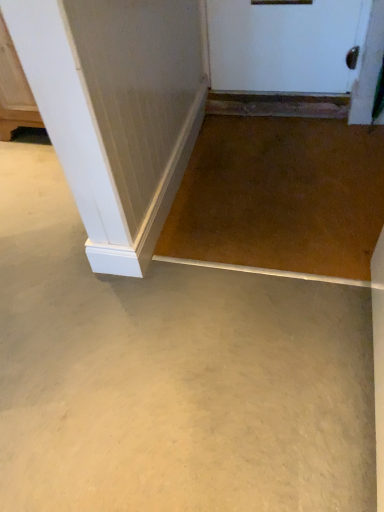
What do you see at coordinates (171, 375) in the screenshot? I see `smooth concrete floor at center` at bounding box center [171, 375].

Find the location of `smooth concrete floor at center`. smooth concrete floor at center is located at coordinates (171, 375).

The width and height of the screenshot is (384, 512). Describe the element at coordinates (368, 68) in the screenshot. I see `clear glass screen door at upper right` at that location.

What is the approximate height of clear glass screen door at upper right?

60.81 centimeters.

At what (x,y) coordinates should I click in order to perform the action: click on clear glass screen door at upper right. Please return your answer as a coordinate pair (x, y). The image size is (384, 512). Looking at the image, I should click on (368, 68).

This screenshot has height=512, width=384. Identify the location of smooth concrete floor at center. (171, 375).

Which is more to the right, clear glass screen door at upper right or smooth concrete floor at center?

clear glass screen door at upper right is more to the right.

Is clear glass screen door at upper right in front of or behind smooth concrete floor at center in the image?

clear glass screen door at upper right is positioned farther from the viewer than smooth concrete floor at center.

Does point (361, 69) come farther from viewer compared to point (198, 364)?

Yes, point (361, 69) is behind point (198, 364).

From the image's perspective, is clear glass screen door at upper right positioned above or below smooth concrete floor at center?

Clearly, from the image's perspective, clear glass screen door at upper right is above smooth concrete floor at center.

From a real-world perspective, is clear glass screen door at upper right beneath smooth concrete floor at center?

No, from a real-world perspective, clear glass screen door at upper right is not beneath smooth concrete floor at center.

Is clear glass screen door at upper right thinner than smooth concrete floor at center?

Correct, the width of clear glass screen door at upper right is less than that of smooth concrete floor at center.

Between clear glass screen door at upper right and smooth concrete floor at center, which one has less height?

Standing shorter between the two is smooth concrete floor at center.

Who is bigger, clear glass screen door at upper right or smooth concrete floor at center?

smooth concrete floor at center is bigger.

Is smooth concrete floor at center inside clear glass screen door at upper right?

No, clear glass screen door at upper right does not contain smooth concrete floor at center.

Is clear glass screen door at upper right far from smooth concrete floor at center?

Yes.

Could you tell me if clear glass screen door at upper right is turned towards smooth concrete floor at center?

No, clear glass screen door at upper right is not aimed at smooth concrete floor at center.

How distant is clear glass screen door at upper right from smooth concrete floor at center?

They are 5.10 feet apart.

Locate an element on the screen. The width and height of the screenshot is (384, 512). screen door on the right of smooth concrete floor at center is located at coordinates (368, 68).

Is smooth concrete floor at center at the right side of clear glass screen door at upper right?

No, smooth concrete floor at center is not to the right of clear glass screen door at upper right.

Is smooth concrete floor at center in front of or behind clear glass screen door at upper right in the image?

Visually, smooth concrete floor at center is located in front of clear glass screen door at upper right.

Does point (288, 418) come farther from viewer compared to point (382, 2)?

That is False.

From the image's perspective, is smooth concrete floor at center above or below clear glass screen door at upper right?

smooth concrete floor at center is below clear glass screen door at upper right.

From a real-world perspective, is smooth concrete floor at center positioned over clear glass screen door at upper right based on gravity?

No.

Which object is thinner, smooth concrete floor at center or clear glass screen door at upper right?

Thinner between the two is clear glass screen door at upper right.

Does smooth concrete floor at center have a greater height compared to clear glass screen door at upper right?

In fact, smooth concrete floor at center may be shorter than clear glass screen door at upper right.

Considering the relative sizes of smooth concrete floor at center and clear glass screen door at upper right in the image provided, is smooth concrete floor at center bigger than clear glass screen door at upper right?

Correct, smooth concrete floor at center is larger in size than clear glass screen door at upper right.

Is smooth concrete floor at center located outside clear glass screen door at upper right?

Absolutely, smooth concrete floor at center is external to clear glass screen door at upper right.

Is smooth concrete floor at center in contact with clear glass screen door at upper right?

They are not placed beside each other.

Is smooth concrete floor at center facing away from clear glass screen door at upper right?

No, smooth concrete floor at center is not facing away from clear glass screen door at upper right.

How different are the orientations of smooth concrete floor at center and clear glass screen door at upper right in degrees?

smooth concrete floor at center and clear glass screen door at upper right are facing 121 degrees away from each other.

Measure the distance between smooth concrete floor at center and clear glass screen door at upper right.

smooth concrete floor at center and clear glass screen door at upper right are 1.55 meters apart.

The width and height of the screenshot is (384, 512). I want to click on concrete that appears on the left of clear glass screen door at upper right, so click(x=171, y=375).

The image size is (384, 512). What are the coordinates of `screen door above the smooth concrete floor at center (from the image's perspective)` in the screenshot? It's located at (368, 68).

The height and width of the screenshot is (512, 384). What are the coordinates of `screen door behind the smooth concrete floor at center` in the screenshot? It's located at [x=368, y=68].